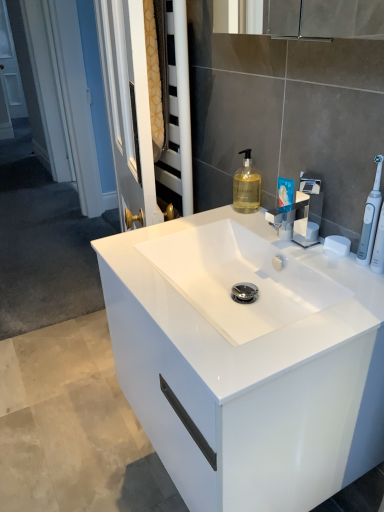
At what (x,y) coordinates should I click in order to perform the action: click on vacant space behind satin nickel faucet at center. Please return your answer as a coordinate pair (x, y). This screenshot has width=384, height=512. Looking at the image, I should click on (256, 226).